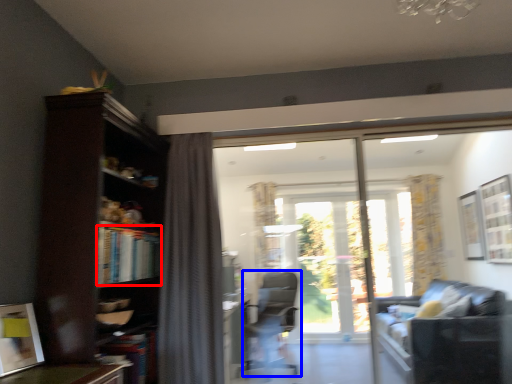
Question: Which point is closer to the camera, book (highlighted by a red box) or chair (highlighted by a blue box)?

Choices:
 (A) book
 (B) chair

Answer: (A)